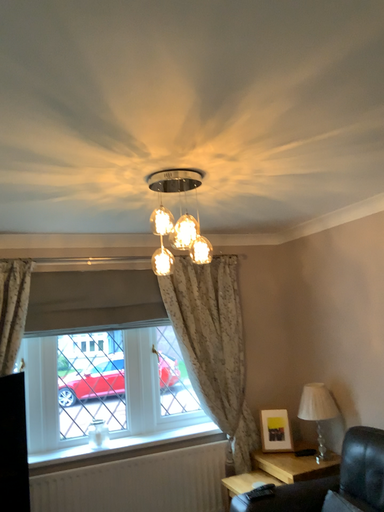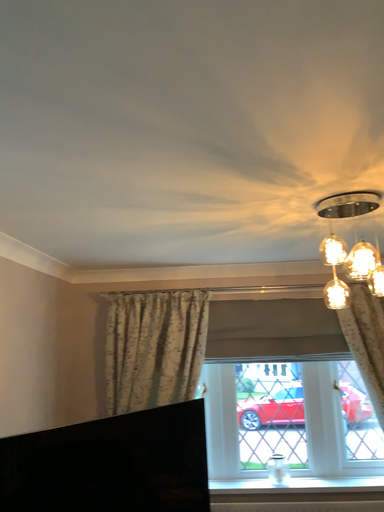
Question: Which way did the camera rotate in the video?

Choices:
 (A) rotated left
 (B) rotated right

Answer: (A)